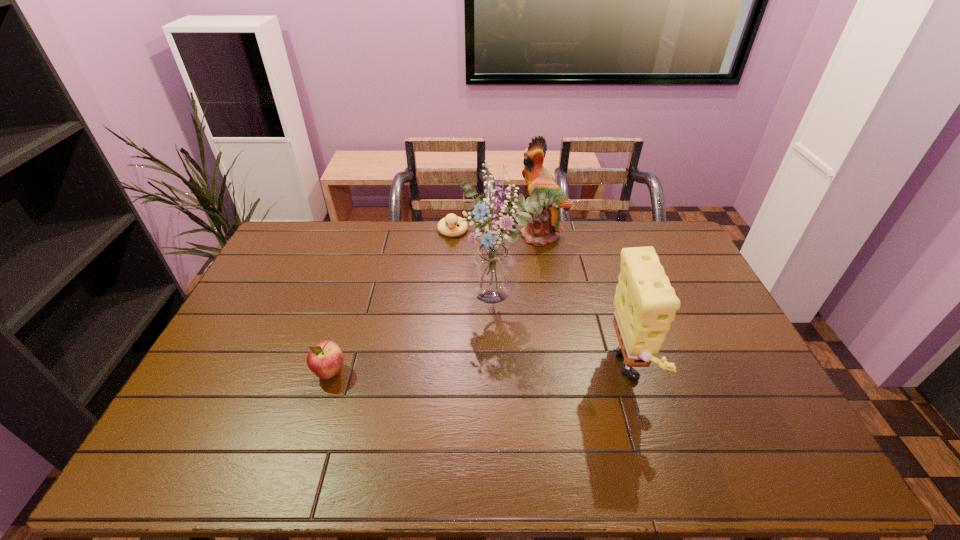
Locate an element on the screen. This screenshot has width=960, height=540. vacant space located 0.240m on the front-facing side of the third farthest object is located at coordinates pos(466,376).

Locate an element on the screen. The width and height of the screenshot is (960, 540). vacant space located on the front-facing side of the third farthest object is located at coordinates (484, 333).

This screenshot has width=960, height=540. In order to click on vacant position located 0.160m on the front-facing side of the parrot in this screenshot , I will do `click(517, 270)`.

This screenshot has height=540, width=960. In order to click on vacant space positioned on the front-facing side of the parrot in this screenshot , I will do `click(507, 287)`.

Locate an element on the screen. The width and height of the screenshot is (960, 540). free space located on the front-facing side of the parrot is located at coordinates (513, 279).

Find the location of `vacant position located at the beak of the shortest object`. vacant position located at the beak of the shortest object is located at coordinates point(444,310).

Identify the location of vacant space situated 0.290m at the beak of the shortest object. (445, 293).

Where is `vacant region located 0.170m at the beak of the shortest object`? Image resolution: width=960 pixels, height=540 pixels. vacant region located 0.170m at the beak of the shortest object is located at coordinates (448, 269).

This screenshot has width=960, height=540. Find the location of `parrot that is at the far edge`. parrot that is at the far edge is located at coordinates (542, 230).

The height and width of the screenshot is (540, 960). I want to click on duckling present at the far edge, so click(451, 220).